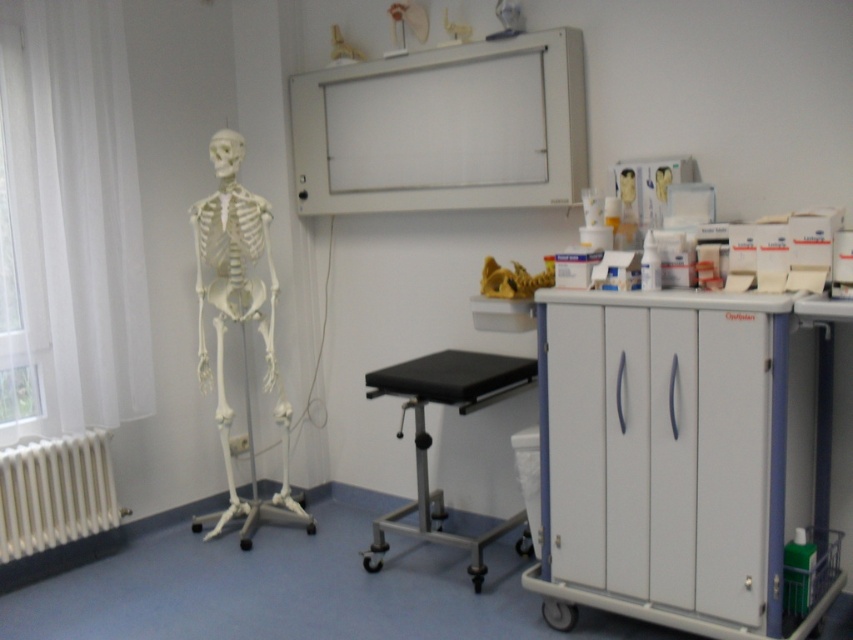
Which of these two, white plastic skeleton at left or white matte radiator at lower left, stands taller?

Standing taller between the two is white plastic skeleton at left.

Is white plastic skeleton at left above white matte radiator at lower left?

Indeed, white plastic skeleton at left is positioned over white matte radiator at lower left.

Which is in front, point (218, 243) or point (76, 483)?

Positioned in front is point (76, 483).

The height and width of the screenshot is (640, 853). Find the location of `white plastic skeleton at left`. white plastic skeleton at left is located at coordinates click(239, 326).

Does white plastic skeleton at left lie behind black rubber stool at center?

Yes, it is behind black rubber stool at center.

Can you confirm if white plastic skeleton at left is positioned below black rubber stool at center?

Incorrect, white plastic skeleton at left is not positioned below black rubber stool at center.

Who is more forward, (x=225, y=467) or (x=434, y=531)?

Point (x=434, y=531)

Identify the location of white plastic skeleton at left. (239, 326).

Does point (396, 520) lie behind point (19, 490)?

Yes, point (396, 520) is farther from viewer.

Does black rubber stool at center have a greater width compared to white matte radiator at lower left?

Yes.

Between point (447, 394) and point (65, 516), which one is positioned behind?

Positioned behind is point (65, 516).

Where is `black rubber stool at center`? Image resolution: width=853 pixels, height=640 pixels. black rubber stool at center is located at coordinates (431, 438).